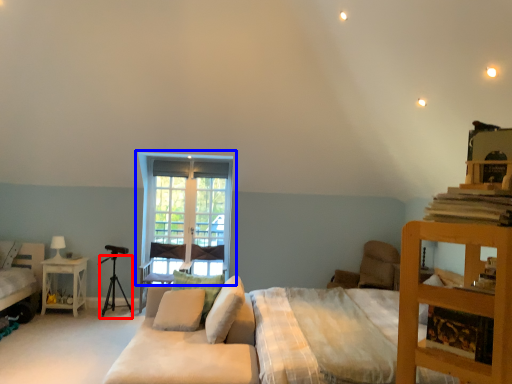
Question: Which object appears closest to the camera in this image, tripod (highlighted by a red box) or window (highlighted by a blue box)?

Choices:
 (A) tripod
 (B) window

Answer: (A)